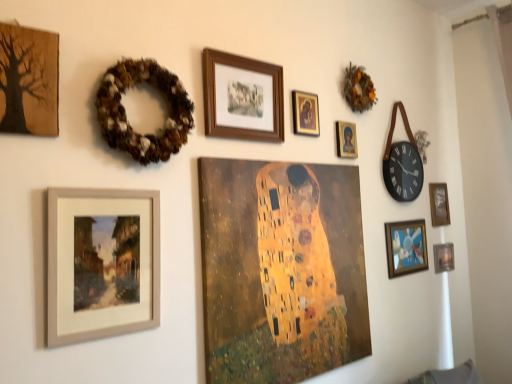
I want to click on wooden frame at upper center, placed as the 3th picture frame when sorted from left to right, so click(233, 101).

Measure the distance between wooden frame at upper center, placed as the 3th picture frame when sorted from left to right, and camera.

The distance of wooden frame at upper center, placed as the 3th picture frame when sorted from left to right, from camera is 5.15 feet.

Locate an element on the screen. The height and width of the screenshot is (384, 512). matte wooden frame at lower left, placed as the 2th picture frame when sorted from left to right is located at coordinates (102, 263).

This screenshot has height=384, width=512. What do you see at coordinates (102, 263) in the screenshot? I see `matte wooden frame at lower left, placed as the 2th picture frame when sorted from left to right` at bounding box center [102, 263].

The width and height of the screenshot is (512, 384). I want to click on gold textured canvas at center, the 6th picture frame in the right-to-left sequence, so click(x=281, y=270).

At what (x,y) coordinates should I click in order to perform the action: click on wooden frame at upper center, placed as the 3th picture frame when sorted from left to right. Please return your answer as a coordinate pair (x, y). The height and width of the screenshot is (384, 512). Looking at the image, I should click on (233, 101).

Is black leather wall clock at upper right positioned in front of wooden textured tree at upper left, acting as the 9th picture frame starting from the right?

No, black leather wall clock at upper right is further to the viewer.

From a real-world perspective, is black leather wall clock at upper right positioned under wooden textured tree at upper left, marked as the 1th picture frame in a left-to-right arrangement, based on gravity?

Yes, from a real-world perspective, black leather wall clock at upper right is beneath wooden textured tree at upper left, marked as the 1th picture frame in a left-to-right arrangement.

At what (x,y) coordinates should I click in order to perform the action: click on the 6th picture frame in front of the black leather wall clock at upper right. Please return your answer as a coordinate pair (x, y). Looking at the image, I should click on (29, 81).

Can you confirm if black leather wall clock at upper right is shorter than wooden textured tree at upper left, acting as the 9th picture frame starting from the right?

No.

Is the surface of wooden textured tree at upper left, acting as the 9th picture frame starting from the right, in direct contact with matte wooden frame at lower left, which appears as the 8th picture frame when viewed from the right?

No, wooden textured tree at upper left, acting as the 9th picture frame starting from the right, is not making contact with matte wooden frame at lower left, which appears as the 8th picture frame when viewed from the right.

Image resolution: width=512 pixels, height=384 pixels. I want to click on the 1st picture frame behind the wooden textured tree at upper left, marked as the 1th picture frame in a left-to-right arrangement, starting your count from the anchor, so click(102, 263).

Does wooden textured tree at upper left, marked as the 1th picture frame in a left-to-right arrangement, turn towards matte wooden frame at lower left, which appears as the 8th picture frame when viewed from the right?

No, wooden textured tree at upper left, marked as the 1th picture frame in a left-to-right arrangement, does not turn towards matte wooden frame at lower left, which appears as the 8th picture frame when viewed from the right.

Is wooden textured tree at upper left, acting as the 9th picture frame starting from the right, wider than matte wooden frame at lower left, placed as the 2th picture frame when sorted from left to right?

No, wooden textured tree at upper left, acting as the 9th picture frame starting from the right, is not wider than matte wooden frame at lower left, placed as the 2th picture frame when sorted from left to right.

Between point (415, 184) and point (132, 204), which one is positioned in front?

Positioned in front is point (132, 204).

Is black leather wall clock at upper right looking in the opposite direction of matte wooden frame at lower left, which appears as the 8th picture frame when viewed from the right?

No, black leather wall clock at upper right is not facing the opposite direction of matte wooden frame at lower left, which appears as the 8th picture frame when viewed from the right.

Consider the image. From a real-world perspective, is black leather wall clock at upper right positioned under matte wooden frame at lower left, which appears as the 8th picture frame when viewed from the right, based on gravity?

No.

In the image, is black leather wall clock at upper right positioned in front of or behind matte wooden frame at lower left, which appears as the 8th picture frame when viewed from the right?

black leather wall clock at upper right is behind matte wooden frame at lower left, which appears as the 8th picture frame when viewed from the right.

Could you tell me if matte gold picture frame at upper right, positioned as the fourth picture frame in right-to-left order, is turned towards brown textured wreath at upper left, the 2th decor positioned from the back?

No.

Can you tell me how much matte gold picture frame at upper right, the 6th picture frame viewed from the left, and brown textured wreath at upper left, the first decor viewed from the front, differ in facing direction?

The angle between the facing direction of matte gold picture frame at upper right, the 6th picture frame viewed from the left, and the facing direction of brown textured wreath at upper left, the first decor viewed from the front, is 0.005 degrees.

Measure the distance from matte gold picture frame at upper right, positioned as the fourth picture frame in right-to-left order, to brown textured wreath at upper left, placed as the first decor when sorted from bottom to top.

The distance of matte gold picture frame at upper right, positioned as the fourth picture frame in right-to-left order, from brown textured wreath at upper left, placed as the first decor when sorted from bottom to top, is 38.42 inches.

Does point (352, 134) appear closer or farther from the camera than point (182, 90)?

Clearly, point (352, 134) is more distant from the camera than point (182, 90).

Is brown textured wreath at upper right, the second decor when ordered from left to right, surrounded by wooden frame at upper center, placed as the 3th picture frame when sorted from left to right?

No, wooden frame at upper center, placed as the 3th picture frame when sorted from left to right, does not contain brown textured wreath at upper right, the second decor when ordered from left to right.

Which is less distant, (282, 91) or (371, 91)?

Point (282, 91)

Is wooden frame at upper center, the 7th picture frame in the right-to-left sequence, turned away from brown textured wreath at upper right, which is counted as the second decor, starting from the bottom?

wooden frame at upper center, the 7th picture frame in the right-to-left sequence, is not turned away from brown textured wreath at upper right, which is counted as the second decor, starting from the bottom.

Is wooden frame at upper center, the 7th picture frame in the right-to-left sequence, not close to brown textured wreath at upper right, the second decor when ordered from left to right?

No, there isn't a large distance between wooden frame at upper center, the 7th picture frame in the right-to-left sequence, and brown textured wreath at upper right, the second decor when ordered from left to right.

The image size is (512, 384). What are the coordinates of `the 5th picture frame below the gold-framed portrait at upper center, which is the fifth picture frame in left-to-right order (from the image's perspective)` in the screenshot? It's located at (406, 247).

How different are the orientations of gold-framed portrait at upper center, which is the fifth picture frame in left-to-right order, and wooden framed picture at lower right, the 7th picture frame in the left-to-right sequence, in degrees?

0.01 degrees separate the facing orientations of gold-framed portrait at upper center, which is the fifth picture frame in left-to-right order, and wooden framed picture at lower right, the 7th picture frame in the left-to-right sequence.

In the image, is gold-framed portrait at upper center, which is the fifth picture frame in left-to-right order, on the left side or the right side of wooden framed picture at lower right, the 7th picture frame in the left-to-right sequence?

gold-framed portrait at upper center, which is the fifth picture frame in left-to-right order, is positioned on wooden framed picture at lower right, the 7th picture frame in the left-to-right sequence,'s left side.

From a real-world perspective, which is physically below, gold-framed portrait at upper center, which is the fifth picture frame in left-to-right order, or wooden framed picture at lower right, the 7th picture frame in the left-to-right sequence?

In real-world perspective, wooden framed picture at lower right, the 7th picture frame in the left-to-right sequence, is lower.

Is gold textured canvas at center, the 6th picture frame in the right-to-left sequence, at the left side of black leather wall clock at upper right?

Yes.

Measure the distance between gold textured canvas at center, the fourth picture frame positioned from the left, and black leather wall clock at upper right.

30.78 inches.

Is gold textured canvas at center, the fourth picture frame positioned from the left, not near black leather wall clock at upper right?

No, gold textured canvas at center, the fourth picture frame positioned from the left, is in close proximity to black leather wall clock at upper right.

Is gold textured canvas at center, the fourth picture frame positioned from the left, facing towards black leather wall clock at upper right?

No, gold textured canvas at center, the fourth picture frame positioned from the left, is not turned towards black leather wall clock at upper right.

Find the location of a particular element. wall clock behind the wooden textured tree at upper left, acting as the 9th picture frame starting from the right is located at coordinates (403, 172).

Starting from the wooden textured tree at upper left, marked as the 1th picture frame in a left-to-right arrangement, which picture frame is the 1st one to the right? Please provide its 2D coordinates.

[(102, 263)]

Considering their positions, is brown textured wreath at upper right, acting as the 1th decor starting from the top, positioned further to wooden textured tree at upper left, marked as the 1th picture frame in a left-to-right arrangement, than brown textured wreath at upper left, the 2th decor positioned from the back?

The object further to wooden textured tree at upper left, marked as the 1th picture frame in a left-to-right arrangement, is brown textured wreath at upper right, acting as the 1th decor starting from the top.

From the picture: From the image, which object appears to be farther from brown textured wreath at upper left, the first decor viewed from the front, gold textured canvas at center, the fourth picture frame positioned from the left, or wooden textured tree at upper left, acting as the 9th picture frame starting from the right?

gold textured canvas at center, the fourth picture frame positioned from the left, is positioned further to the anchor brown textured wreath at upper left, the first decor viewed from the front.

From the image, which object appears to be farther from matte wooden frame at lower left, placed as the 2th picture frame when sorted from left to right, matte gold picture frame at upper right, the 6th picture frame viewed from the left, or wooden frame at upper center, the 7th picture frame in the right-to-left sequence?

Among the two, matte gold picture frame at upper right, the 6th picture frame viewed from the left, is located further to matte wooden frame at lower left, placed as the 2th picture frame when sorted from left to right.

Considering their positions, is wooden frame at right, which appears as the second picture frame when viewed from the right, positioned closer to metallic silver picture frame at lower right, arranged as the 9th picture frame when viewed from the left, than brown textured wreath at upper left, the first decor viewed from the front?

wooden frame at right, which appears as the second picture frame when viewed from the right.

Estimate the real-world distances between objects in this image. Which object is further from matte wooden frame at lower left, placed as the 2th picture frame when sorted from left to right, metallic silver picture frame at lower right, the 1th picture frame viewed from the right, or matte gold picture frame at upper right, the 6th picture frame viewed from the left?

metallic silver picture frame at lower right, the 1th picture frame viewed from the right, lies further to matte wooden frame at lower left, placed as the 2th picture frame when sorted from left to right, than the other object.

When comparing their distances from wooden textured tree at upper left, acting as the 9th picture frame starting from the right, does wooden frame at upper center, placed as the 3th picture frame when sorted from left to right, or matte gold picture frame at upper right, the 6th picture frame viewed from the left, seem closer?

The object closer to wooden textured tree at upper left, acting as the 9th picture frame starting from the right, is wooden frame at upper center, placed as the 3th picture frame when sorted from left to right.

From the image, which object appears to be farther from black leather wall clock at upper right, gold textured canvas at center, the fourth picture frame positioned from the left, or wooden frame at upper center, placed as the 3th picture frame when sorted from left to right?

wooden frame at upper center, placed as the 3th picture frame when sorted from left to right, is positioned further to the anchor black leather wall clock at upper right.

Estimate the real-world distances between objects in this image. Which object is closer to wooden frame at right, which appears as the second picture frame when viewed from the right, gold-framed portrait at upper center, which is the fifth picture frame in left-to-right order, or wooden framed picture at lower right, the 3th picture frame when ordered from right to left?

Based on the image, wooden framed picture at lower right, the 3th picture frame when ordered from right to left, appears to be nearer to wooden frame at right, which appears as the second picture frame when viewed from the right.

Locate an element on the screen. The image size is (512, 384). decor between wooden textured tree at upper left, acting as the 9th picture frame starting from the right, and brown textured wreath at upper right, the 1th decor when ordered from back to front, in the horizontal direction is located at coordinates (126, 116).

Identify the location of decor between brown textured wreath at upper left, which is the first decor in left-to-right order, and wooden framed picture at lower right, the 7th picture frame in the left-to-right sequence, from left to right. (358, 89).

Image resolution: width=512 pixels, height=384 pixels. What are the coordinates of `wall clock located between brown textured wreath at upper left, the 2th decor positioned from the back, and wooden frame at right, the eighth picture frame viewed from the left, in the left-right direction` in the screenshot? It's located at (403, 172).

Locate an element on the screen. This screenshot has height=384, width=512. wall clock between gold-framed portrait at upper center, placed as the 5th picture frame when sorted from right to left, and wooden framed picture at lower right, the 3th picture frame when ordered from right to left, in the horizontal direction is located at coordinates (403, 172).